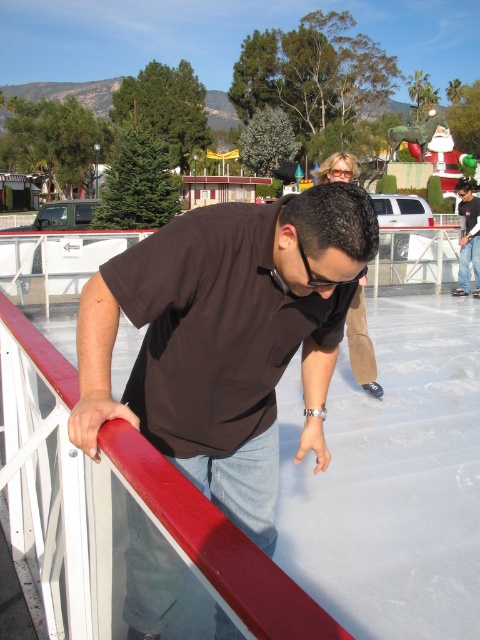
Question: Does matte black shirt at center appear under brown matte shirt at center?

Choices:
 (A) no
 (B) yes

Answer: (B)

Question: Which object is farther from the camera taking this photo?

Choices:
 (A) brown matte shirt at center
 (B) matte black shirt at center

Answer: (A)

Question: Which point is closer to the camera?

Choices:
 (A) matte black shirt at center
 (B) brown matte shirt at center

Answer: (A)

Question: Which object is closer to the camera taking this photo?

Choices:
 (A) matte black shirt at center
 (B) brown matte shirt at center

Answer: (A)

Question: Does matte black shirt at center have a larger size compared to brown matte shirt at center?

Choices:
 (A) no
 (B) yes

Answer: (A)

Question: Is matte black shirt at center above brown matte shirt at center?

Choices:
 (A) no
 (B) yes

Answer: (A)